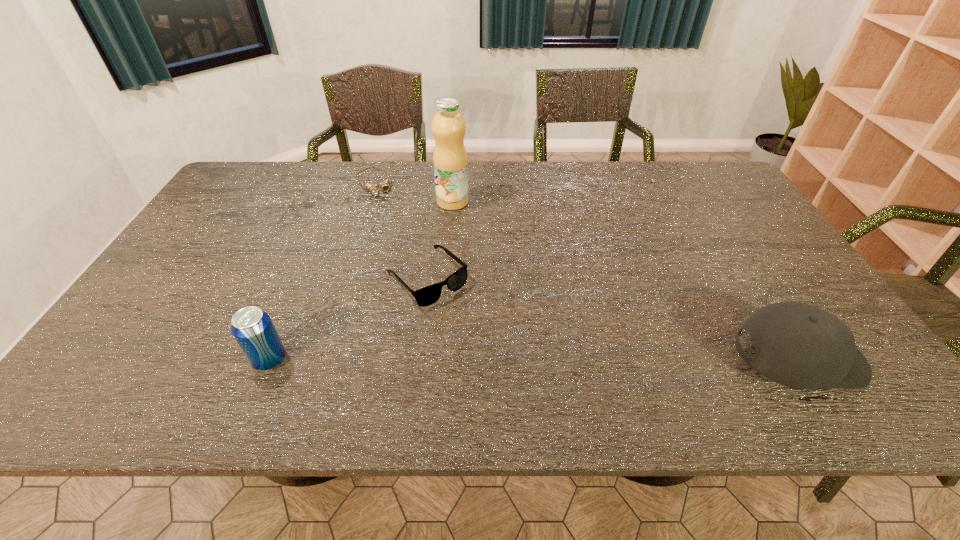
At what (x,y) coordinates should I click in order to perform the action: click on vacant space that is in between the beer can and the sunglasses. Please return your answer as a coordinate pair (x, y). Image resolution: width=960 pixels, height=540 pixels. Looking at the image, I should click on coord(348,319).

This screenshot has height=540, width=960. Find the location of `free spot between the baseball cap and the third farthest object`. free spot between the baseball cap and the third farthest object is located at coordinates (612, 319).

You are a GUI agent. You are given a task and a screenshot of the screen. Output one action in this format:
    pyautogui.click(x=<x>, y=<y>)
    Task: Click on the unoccupied position between the fourth tallest object and the tallest object
    The height and width of the screenshot is (540, 960).
    Given the screenshot: What is the action you would take?
    pyautogui.click(x=440, y=240)

Where is `vacant space that is in between the rightmost object and the shortest object`? vacant space that is in between the rightmost object and the shortest object is located at coordinates (585, 273).

Identify the location of vacant area that lies between the baseball cap and the beer can. The image size is (960, 540). (533, 360).

At what (x,y) coordinates should I click in order to perform the action: click on empty space between the goggles and the sunglasses. Please return your answer as a coordinate pair (x, y). The height and width of the screenshot is (540, 960). Looking at the image, I should click on coord(400,231).

You are a GUI agent. You are given a task and a screenshot of the screen. Output one action in this format:
    pyautogui.click(x=<x>, y=<y>)
    Task: Click on the free space between the beer can and the fruit juice
    The image size is (960, 540).
    Given the screenshot: What is the action you would take?
    tap(361, 281)

The height and width of the screenshot is (540, 960). Identify the location of empty space that is in between the tallest object and the shortest object. (413, 193).

I want to click on empty space between the beer can and the rightmost object, so click(533, 360).

At what (x,y) coordinates should I click in order to perform the action: click on object identified as the second closest to the beer can. Please return your answer as a coordinate pair (x, y). The height and width of the screenshot is (540, 960). Looking at the image, I should click on (384, 185).